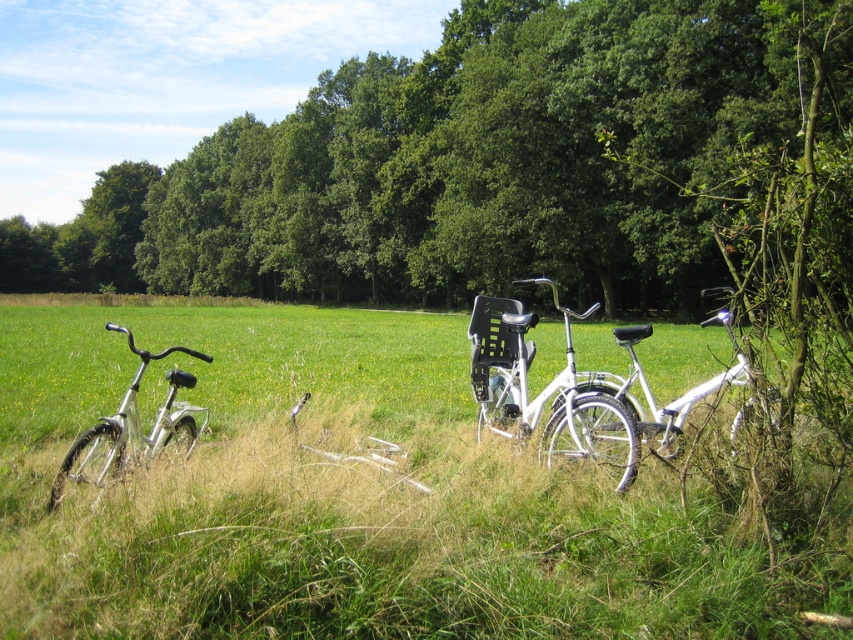
You are standing at the point with coordinates point (468,163). Which object are you closest to?

You are closest to the green leafy tree at center because the point (468,163) corresponds to that object.

You are standing at the point marked by the coordinates point (468, 163) in the image. Looking around, you see the green leafy tree at center. What is directly beneath your feet?

The point (468, 163) corresponds to the green leafy tree at center, so directly beneath your feet is the green leafy tree at center.

You are a delivery person who needs to move a package from the silver metallic bicycle at left to the white matte bicycle at right. Given that the path between them is clear, which direction should you move the package to reach the destination?

You should move the package to the right, as the silver metallic bicycle at left is positioned to the left of the white matte bicycle at right.